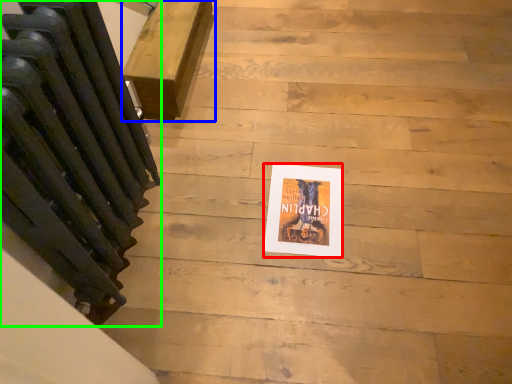
Question: Based on their relative distances, which object is nearer to flyer (highlighted by a red box)? Choose from furniture (highlighted by a blue box) and radiator (highlighted by a green box).

Choices:
 (A) furniture
 (B) radiator

Answer: (B)